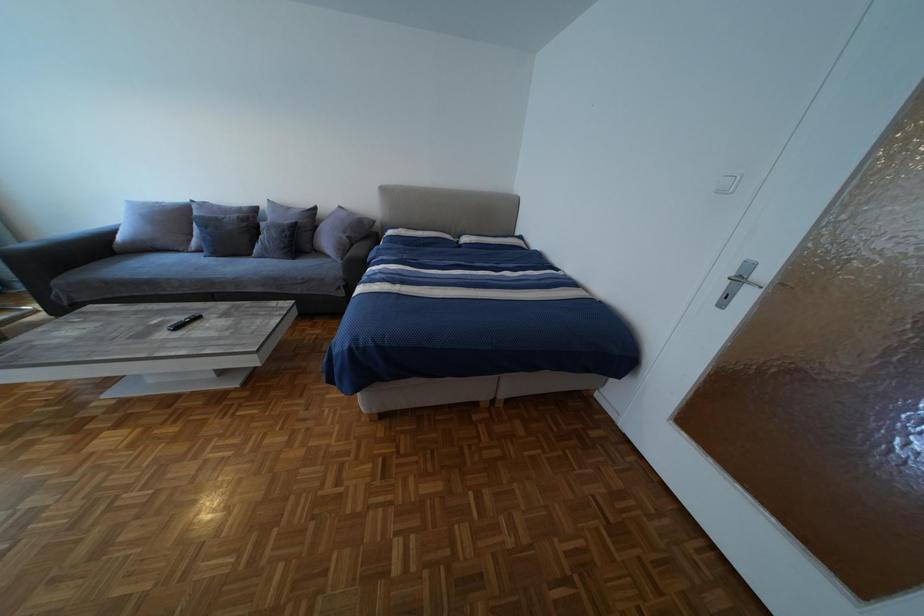
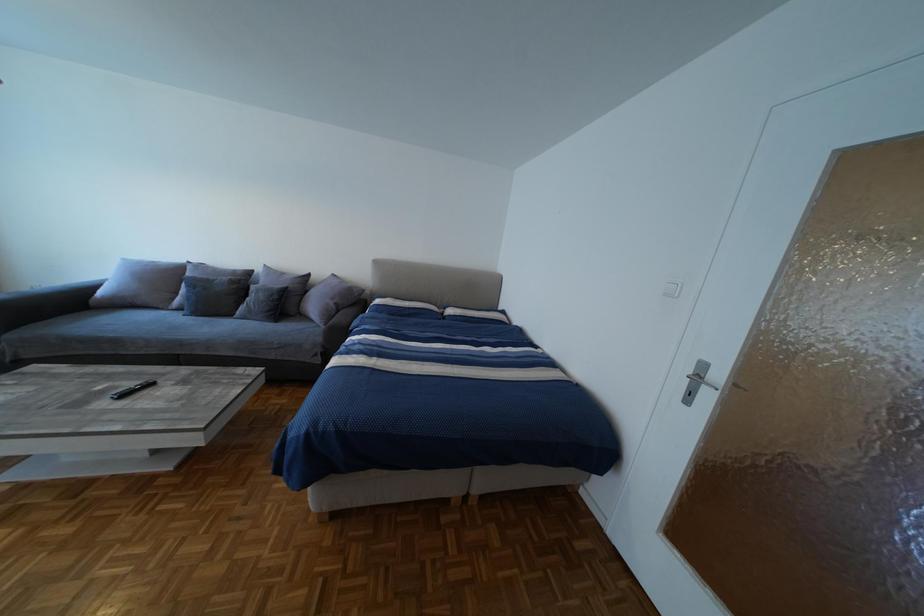
Question: The first image is from the beginning of the video and the second image is from the end. How did the camera likely rotate when shooting the video?

Choices:
 (A) Left
 (B) Right
 (C) Up
 (D) Down

Answer: (C)